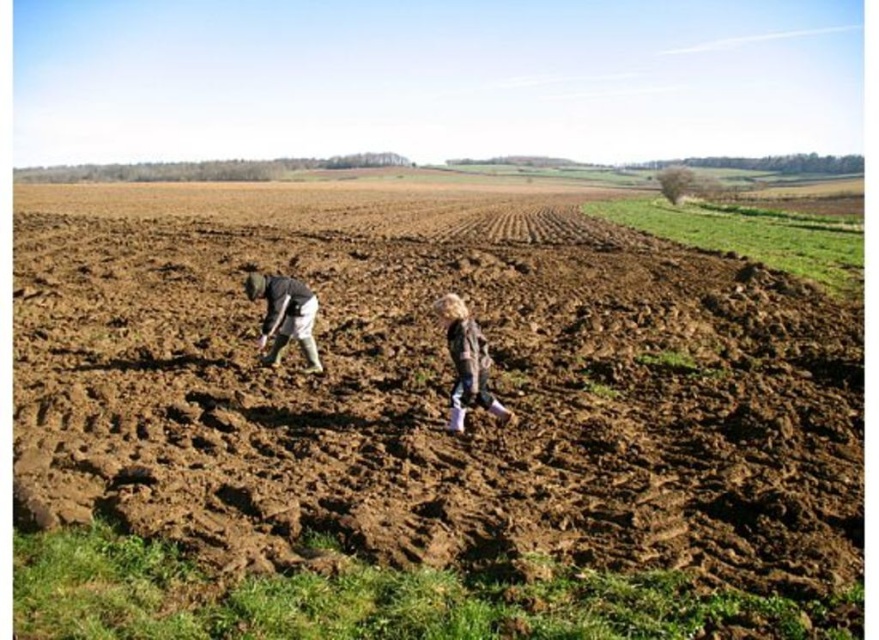
Question: Does brown soil at center have a greater width compared to light brown fabric jacket at center?

Choices:
 (A) no
 (B) yes

Answer: (B)

Question: Which is farther from the brown soil at center?

Choices:
 (A) dark gray fabric at lower left
 (B) light brown fabric jacket at center

Answer: (B)

Question: Which point appears farthest from the camera in this image?

Choices:
 (A) (282, 333)
 (B) (456, 346)

Answer: (A)

Question: In this image, where is brown soil at center located relative to dark gray fabric at lower left?

Choices:
 (A) below
 (B) above

Answer: (B)

Question: Which of the following is the closest to the observer?

Choices:
 (A) light brown fabric jacket at center
 (B) brown soil at center
 (C) dark gray fabric at lower left

Answer: (B)

Question: Is brown soil at center smaller than light brown fabric jacket at center?

Choices:
 (A) no
 (B) yes

Answer: (A)